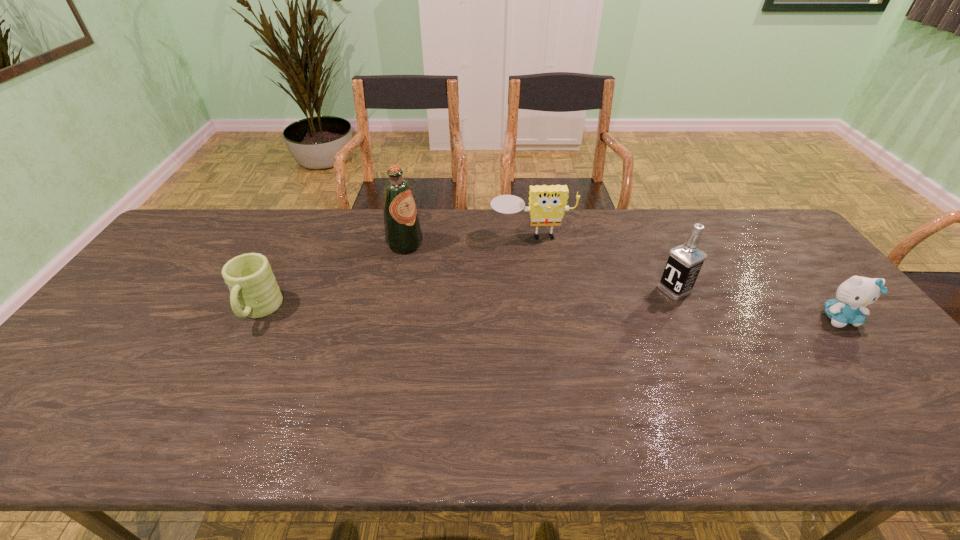
I want to click on free space located on the front-facing side of the third object from right to left, so pyautogui.click(x=540, y=270).

This screenshot has width=960, height=540. I want to click on free spot located 0.180m on the front-facing side of the third object from right to left, so click(x=542, y=284).

Image resolution: width=960 pixels, height=540 pixels. Identify the location of free space located on the front-facing side of the third object from right to left. (540, 272).

Locate an element on the screen. This screenshot has height=540, width=960. vacant space located on the front label of the vodka is located at coordinates (636, 309).

The image size is (960, 540). In order to click on vacant space located on the front label of the vodka in this screenshot , I will do `click(633, 310)`.

The image size is (960, 540). What are the coordinates of `free space located 0.280m on the front label of the vodka` in the screenshot? It's located at (588, 333).

The image size is (960, 540). Identify the location of vacant space situated on the front-facing side of the second object from left to right. (468, 279).

In order to click on free spot located on the front-facing side of the second object from left to right in this screenshot , I will do `click(463, 276)`.

The width and height of the screenshot is (960, 540). What are the coordinates of `vacant space located on the front-facing side of the second object from left to right` in the screenshot? It's located at [494, 294].

Where is `sponge that is positioned at the far edge`? This screenshot has height=540, width=960. sponge that is positioned at the far edge is located at coordinates (547, 204).